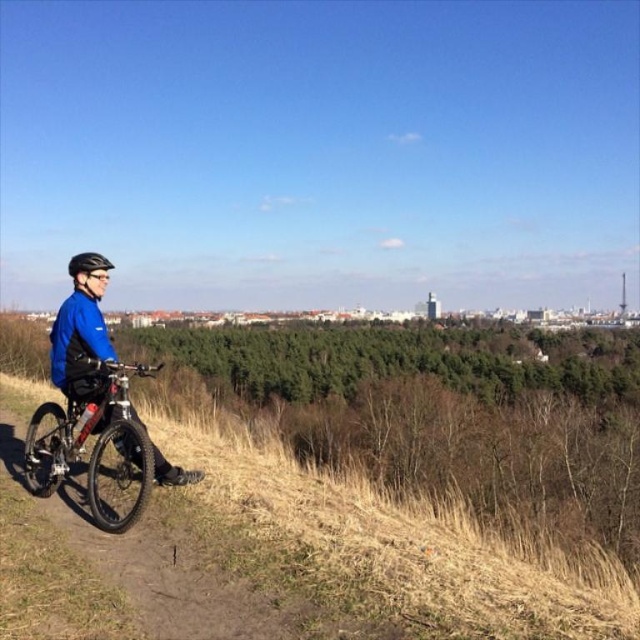
You are a delivery person who needs to secure both the shiny metallic bicycle at lower left and the black matte helmet at left using a 5 feet long chain. Can you chain them together without exceeding the chain length?

The shiny metallic bicycle at lower left and black matte helmet at left are 4.77 feet apart. Since the chain is 5 feet long, which is longer than the distance between them, you can securely chain them together without exceeding the chain length.

You are a photographer trying to capture the cyclist and their gear. You want to ensure both the shiny metallic bicycle at lower left and the black matte helmet at left are in focus. Given their height difference, which object should you adjust your camera focus on first to ensure proper framing?

Since the shiny metallic bicycle at lower left is taller than the black matte helmet at left, you should focus on the shiny metallic bicycle at lower left first to ensure proper framing.

You are standing at the point labeled as point (93, 444) in the image. What object are you currently standing on?

The point (93, 444) corresponds to the shiny metallic bicycle at lower left, so you are standing on the shiny metallic bicycle at lower left.